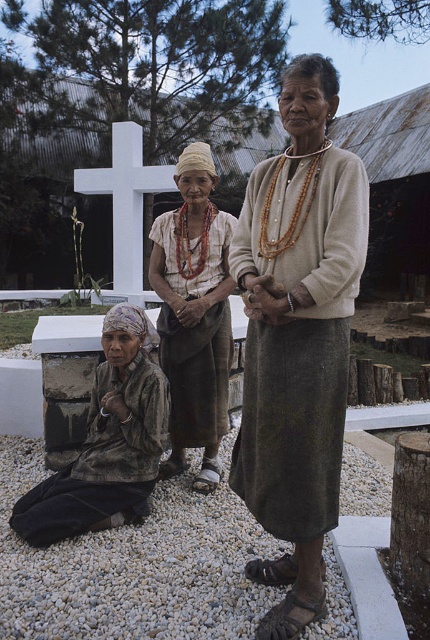
Is point (328, 624) farther from viewer compared to point (157, 262)?

That is False.

Can you confirm if white gravel at lower center is positioned to the right of beige woven fabric dress at center?

No, white gravel at lower center is not to the right of beige woven fabric dress at center.

The height and width of the screenshot is (640, 430). What are the coordinates of `white gravel at lower center` in the screenshot? It's located at (134, 566).

Does beige fabric skirt at center come behind beige woven fabric dress at center?

No, it is not.

Does beige fabric skirt at center have a greater width compared to beige woven fabric dress at center?

Incorrect, beige fabric skirt at center's width does not surpass beige woven fabric dress at center's.

Does point (346, 170) come farther from viewer compared to point (211, 406)?

No, it is not.

Where is `beige fabric skirt at center`? The image size is (430, 640). beige fabric skirt at center is located at coordinates (297, 337).

Can you confirm if beige fabric skirt at center is shorter than white stone cross at center?

Yes.

Is point (288, 604) behind point (168, 168)?

That is False.

Where is `beige fabric skirt at center`? beige fabric skirt at center is located at coordinates [x=297, y=337].